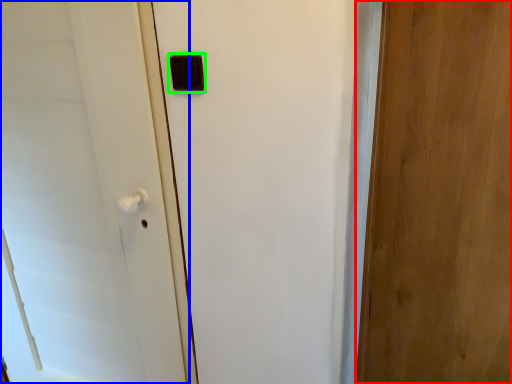
Question: Which object is positioned closest to door (highlighted by a red box)? Select from door (highlighted by a blue box) and light switch (highlighted by a green box).

Choices:
 (A) door
 (B) light switch

Answer: (B)